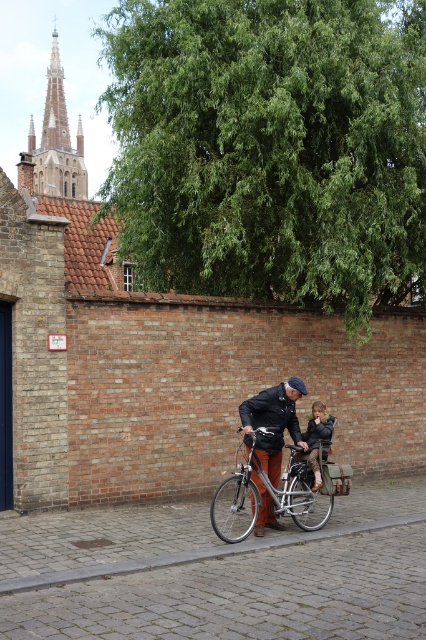
Question: Considering the real-world distances, which object is closest to the silver metallic bicycle at center?

Choices:
 (A) dark brown leather jacket at center
 (B) brown leather jacket at center

Answer: (B)

Question: Which of the following is the closest to the observer?

Choices:
 (A) brown leather jacket at center
 (B) dark brown leather jacket at center

Answer: (A)

Question: Is the position of silver metallic bicycle at center more distant than that of brown leather jacket at center?

Choices:
 (A) yes
 (B) no

Answer: (B)

Question: In this image, where is brown leather jacket at center located relative to dark brown leather jacket at center?

Choices:
 (A) below
 (B) above

Answer: (A)

Question: Which point is farther to the camera?

Choices:
 (A) pyautogui.click(x=305, y=436)
 (B) pyautogui.click(x=238, y=499)

Answer: (A)

Question: Does brown leather jacket at center have a smaller size compared to dark brown leather jacket at center?

Choices:
 (A) yes
 (B) no

Answer: (B)